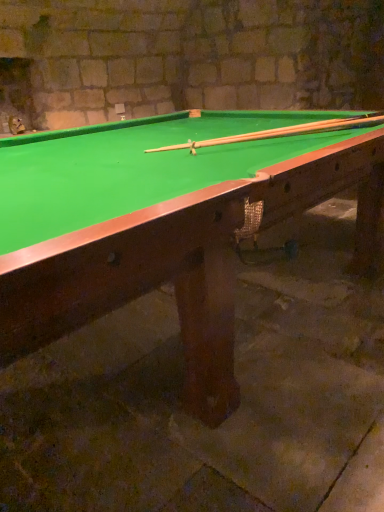
The image size is (384, 512). What are the coordinates of `vacant area on top of wooden cue at center (from a real-world perspective)` in the screenshot? It's located at (253, 130).